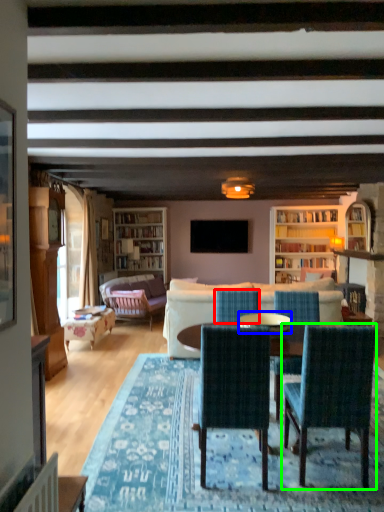
Question: Based on their relative distances, which object is nearer to chair (highlighted by a red box)? Choose from glass table (highlighted by a blue box) and chair (highlighted by a green box).

Choices:
 (A) glass table
 (B) chair

Answer: (A)